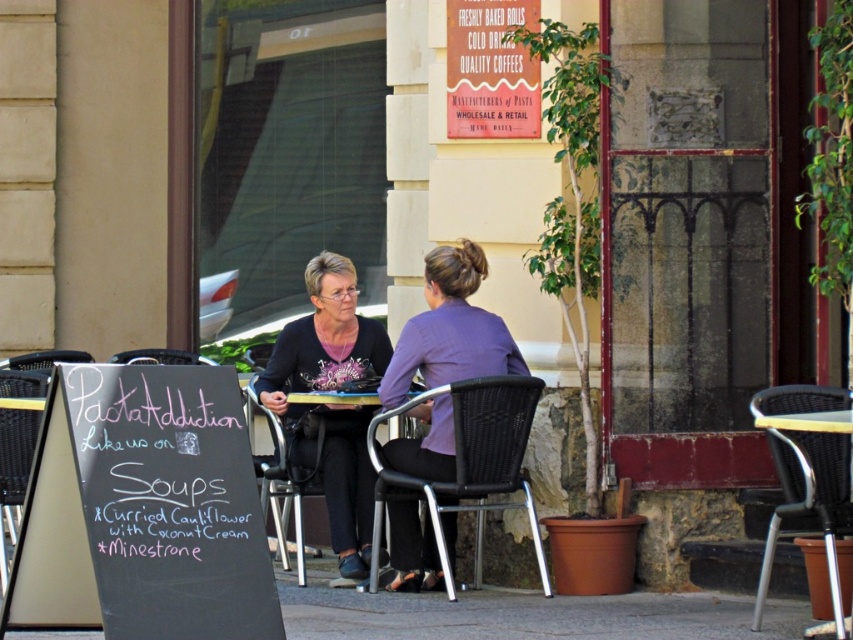
Question: Among these objects, which one is farthest from the camera?

Choices:
 (A) black plastic chair at left
 (B) black mesh chair at lower left

Answer: (A)

Question: Is matte black sweater at center wider than black plastic chair at left?

Choices:
 (A) yes
 (B) no

Answer: (B)

Question: Which point is closer to the camera?

Choices:
 (A) yellow wicker chair at right
 (B) matte black sweater at center
 (C) black plastic chair at left

Answer: (A)

Question: Which point is closer to the camera?

Choices:
 (A) black plastic chair at left
 (B) black chalkboard sign at lower left

Answer: (B)

Question: Can you confirm if black chalkboard sign at lower left is positioned to the right of matte black sweater at center?

Choices:
 (A) no
 (B) yes

Answer: (A)

Question: Is matte black sweater at center to the left of yellow wicker chair at right from the viewer's perspective?

Choices:
 (A) no
 (B) yes

Answer: (B)